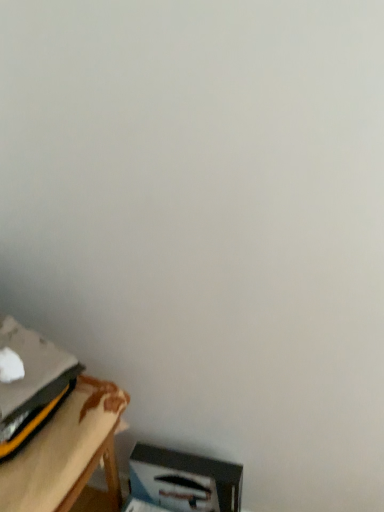
Question: From a real-world perspective, is wooden table at lower left positioned above or below white cardboard box at lower right?

Choices:
 (A) above
 (B) below

Answer: (A)

Question: Is wooden table at lower left in front of or behind white cardboard box at lower right in the image?

Choices:
 (A) behind
 (B) front

Answer: (B)

Question: From the image's perspective, relative to white cardboard box at lower right, is wooden table at lower left above or below?

Choices:
 (A) below
 (B) above

Answer: (B)

Question: Is white cardboard box at lower right inside the boundaries of wooden table at lower left, or outside?

Choices:
 (A) outside
 (B) inside

Answer: (A)

Question: Is point (173, 454) positioned closer to the camera than point (21, 501)?

Choices:
 (A) farther
 (B) closer

Answer: (A)

Question: From a real-world perspective, relative to wooden table at lower left, is white cardboard box at lower right vertically above or below?

Choices:
 (A) above
 (B) below

Answer: (B)

Question: Is white cardboard box at lower right taller or shorter than wooden table at lower left?

Choices:
 (A) short
 (B) tall

Answer: (B)